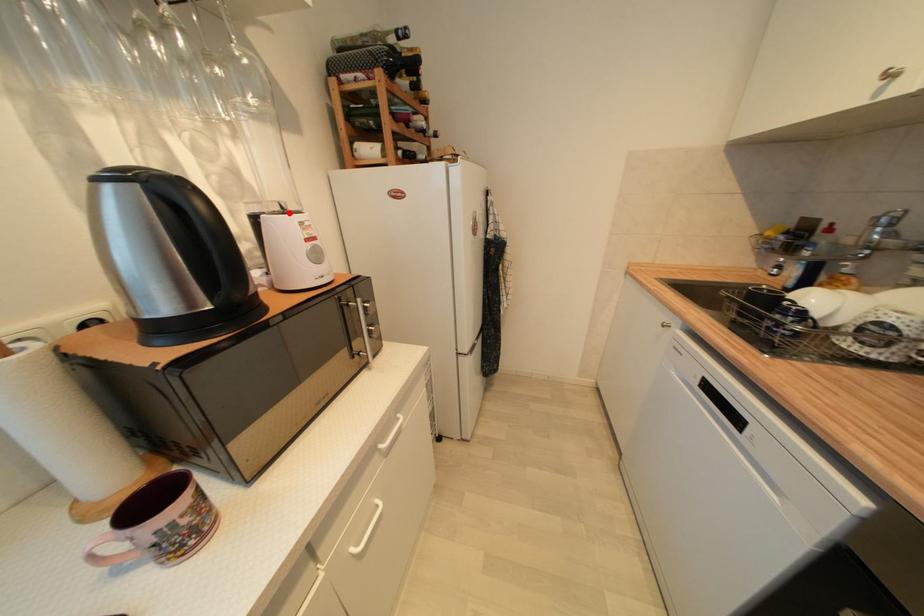
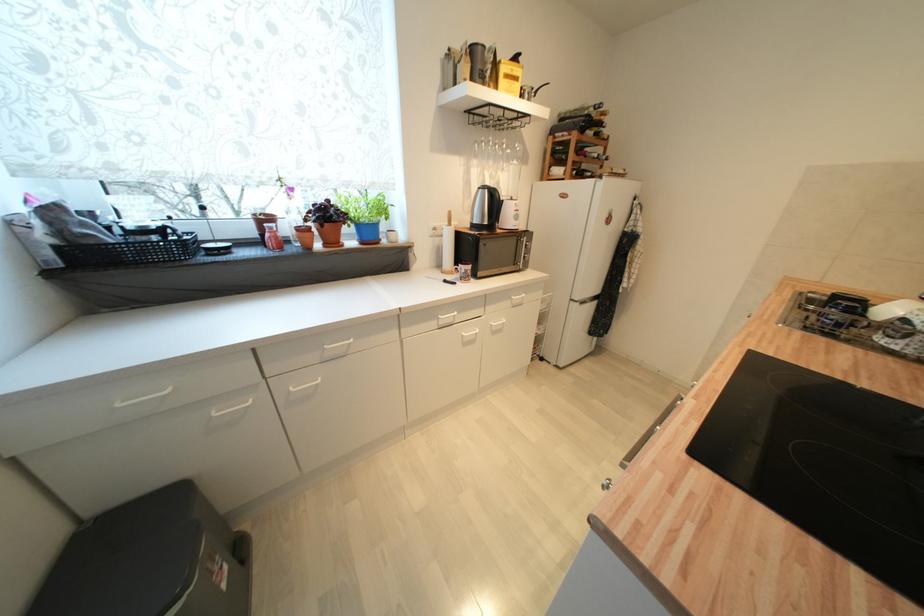
In the second image, find the point that corresponds to the highlighted location in the first image.

(517, 201)